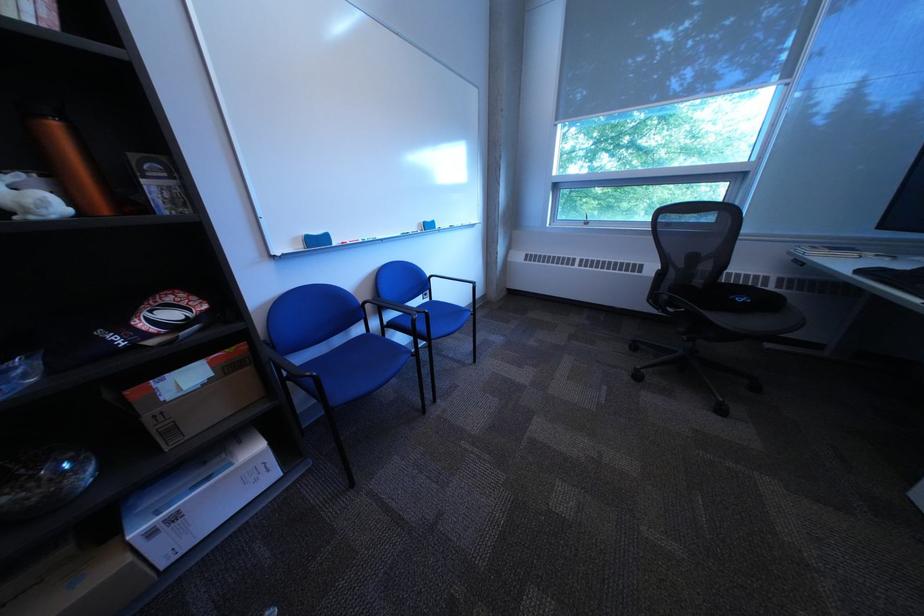
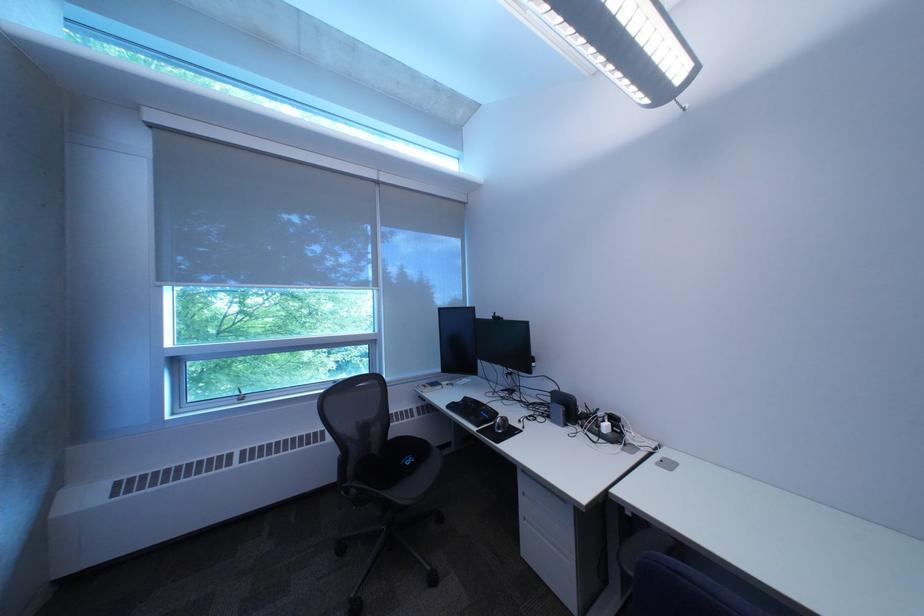
Find the pixel in the second image that matches point 744,185 in the first image.

(383, 347)